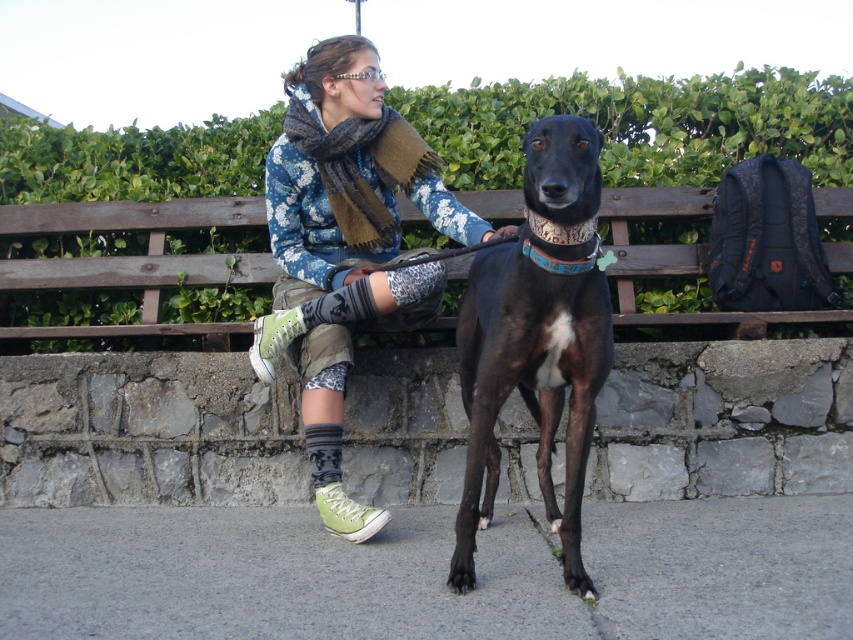
You are a city planner analyzing this outdoor scene. You need to determine if the gray asphalt pavement at lower center can accommodate a new bench that requires 2 square meters of space. Based on the current space occupied by the black smooth dog at center, is there enough room?

The gray asphalt pavement at lower center occupies less space than the black smooth dog at center. Since the dog already takes up more area than the pavement, the pavement cannot provide the required 2 square meters for the new bench.

You are standing in the park and see the green leafy hedge at upper center and the black smooth dog at center. Which object is taller?

The black smooth dog at center is taller than the green leafy hedge at upper center.

From the picture: You are standing in front of the scene described. You want to place a 2.0 meter long wooden bench here. Will the bench fit on the gray asphalt pavement at lower center without overlapping the edges?

The gray asphalt pavement at lower center is 1.98 meters from viewer. Since the bench is 2.0 meters long, it is slightly longer than the available space. Therefore, the bench will not fit without overlapping the edges.